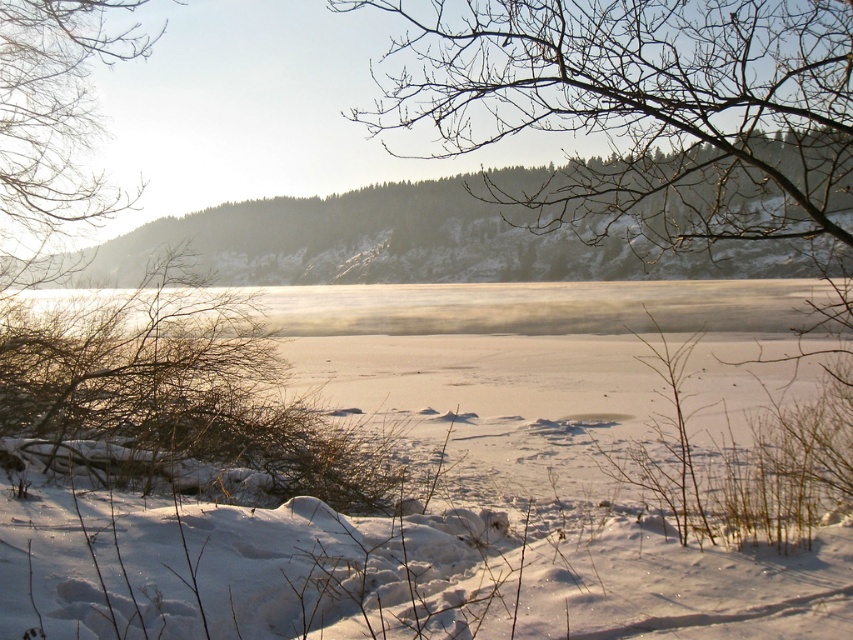
Based on the photo, how much distance is there between green textured hillside at upper center and translucent ice at center?

green textured hillside at upper center is 1.98 meters away from translucent ice at center.

Can you confirm if green textured hillside at upper center is positioned to the right of translucent ice at center?

In fact, green textured hillside at upper center is to the left of translucent ice at center.

Locate an element on the screen. green textured hillside at upper center is located at coordinates (410, 244).

The width and height of the screenshot is (853, 640). What are the coordinates of `green textured hillside at upper center` in the screenshot? It's located at (410, 244).

Is bare branches at upper center to the right of translucent ice at center from the viewer's perspective?

In fact, bare branches at upper center is to the left of translucent ice at center.

Does point (546, 29) come closer to viewer compared to point (682, 285)?

Yes, point (546, 29) is closer to viewer.

Is point (815, 83) positioned behind point (751, 317)?

No, (815, 83) is closer to viewer.

This screenshot has width=853, height=640. Find the location of `bare branches at upper center`. bare branches at upper center is located at coordinates (645, 109).

Does bare branches at upper center lie behind green textured hillside at upper center?

No, it is in front of green textured hillside at upper center.

Does bare branches at upper center have a greater width compared to green textured hillside at upper center?

No.

At what (x,y) coordinates should I click in order to perform the action: click on bare branches at upper center. Please return your answer as a coordinate pair (x, y). Looking at the image, I should click on (645, 109).